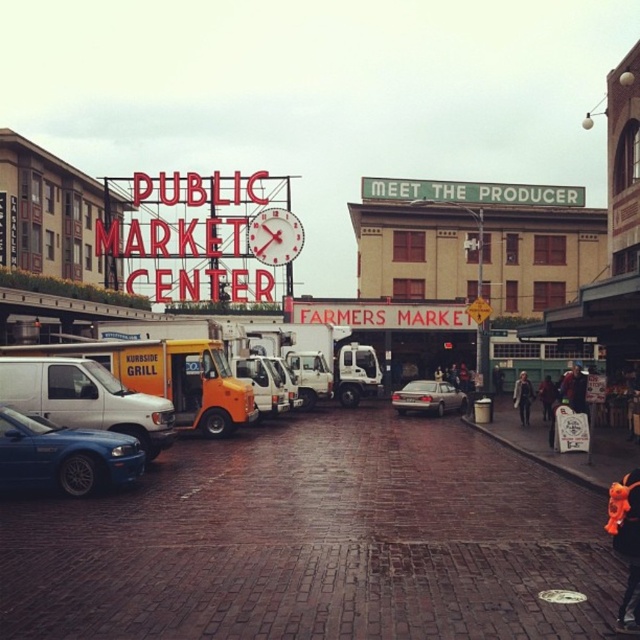
Consider the image. You are standing at the entrance of the Public Market Center and want to reach the point marked at coordinates point (214, 296). Given that you can walk 300 feet per minute, how many minutes will it take you to reach that point?

The distance of point (214, 296) from viewer is 537.05 feet. At a walking speed of 300 feet per minute, it will take approximately 1.8 minutes to reach the point.

You are standing at the entrance of the Public Market Center and want to park your car. The entrance is located at point 0.0. The parking area extends from point 0.0 to point 1.0 along the road. Is there space to park your car between the entrance and the metallic blue sedan at lower left?

The metallic blue sedan at lower left is parked at point 0.713, so there is space between the entrance at 0.0 and the metallic blue sedan at lower left up to 0.713. Therefore, there is space to park your car in that area.